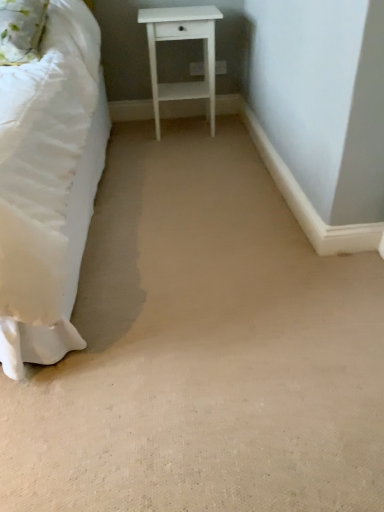
Describe the element at coordinates (21, 30) in the screenshot. I see `fluffy white pillow at upper left` at that location.

In order to click on fluffy white pillow at upper left in this screenshot , I will do `click(21, 30)`.

You are a GUI agent. You are given a task and a screenshot of the screen. Output one action in this format:
    pyautogui.click(x=<x>, y=<y>)
    Task: Click on the white matte nightstand at center
    The width and height of the screenshot is (384, 512).
    Given the screenshot: What is the action you would take?
    pyautogui.click(x=179, y=40)

The width and height of the screenshot is (384, 512). Describe the element at coordinates (179, 40) in the screenshot. I see `white matte nightstand at center` at that location.

Where is `fluffy white pillow at upper left`? The width and height of the screenshot is (384, 512). fluffy white pillow at upper left is located at coordinates (21, 30).

Between white matte nightstand at center and fluffy white pillow at upper left, which one appears on the left side from the viewer's perspective?

Positioned to the left is fluffy white pillow at upper left.

Which object is more forward, white matte nightstand at center or fluffy white pillow at upper left?

fluffy white pillow at upper left is closer to the camera.

Is point (213, 100) more distant than point (14, 2)?

Yes, point (213, 100) is behind point (14, 2).

From the image's perspective, would you say white matte nightstand at center is shown under fluffy white pillow at upper left?

No.

From the picture: From a real-world perspective, which is physically below, white matte nightstand at center or fluffy white pillow at upper left?

In real-world perspective, white matte nightstand at center is lower.

Can you confirm if white matte nightstand at center is wider than fluffy white pillow at upper left?

In fact, white matte nightstand at center might be narrower than fluffy white pillow at upper left.

Is white matte nightstand at center taller or shorter than fluffy white pillow at upper left?

Considering their sizes, white matte nightstand at center has more height than fluffy white pillow at upper left.

Considering the sizes of white matte nightstand at center and fluffy white pillow at upper left in the image, is white matte nightstand at center bigger or smaller than fluffy white pillow at upper left?

Considering their sizes, white matte nightstand at center takes up more space than fluffy white pillow at upper left.

Does white matte nightstand at center contain fluffy white pillow at upper left?

No, fluffy white pillow at upper left is not surrounded by white matte nightstand at center.

Is white matte nightstand at center next to fluffy white pillow at upper left?

No, white matte nightstand at center is not making contact with fluffy white pillow at upper left.

Is fluffy white pillow at upper left at the back of white matte nightstand at center?

That's not correct — white matte nightstand at center is not looking away from fluffy white pillow at upper left.

Identify the location of nightstand that appears below the fluffy white pillow at upper left (from a real-world perspective). This screenshot has height=512, width=384. (179, 40).

Consider the image. Which object is positioned more to the left, fluffy white pillow at upper left or white matte nightstand at center?

From the viewer's perspective, fluffy white pillow at upper left appears more on the left side.

From the picture: Is fluffy white pillow at upper left in front of white matte nightstand at center?

Result: That is True.

Which is nearer, (14, 41) or (185, 23)?

The point (14, 41) is in front.

From the image's perspective, between fluffy white pillow at upper left and white matte nightstand at center, who is located below?

fluffy white pillow at upper left, from the image's perspective.

From the picture: From a real-world perspective, between fluffy white pillow at upper left and white matte nightstand at center, who is vertically higher?

fluffy white pillow at upper left is physically above.

Is fluffy white pillow at upper left thinner than white matte nightstand at center?

No, fluffy white pillow at upper left is not thinner than white matte nightstand at center.

Is fluffy white pillow at upper left shorter than white matte nightstand at center?

Yes, fluffy white pillow at upper left is shorter than white matte nightstand at center.

Considering the sizes of objects fluffy white pillow at upper left and white matte nightstand at center in the image provided, who is smaller, fluffy white pillow at upper left or white matte nightstand at center?

fluffy white pillow at upper left is smaller.

Is fluffy white pillow at upper left inside or outside of white matte nightstand at center?

fluffy white pillow at upper left cannot be found inside white matte nightstand at center.

Would you consider fluffy white pillow at upper left to be distant from white matte nightstand at center?

fluffy white pillow at upper left is actually quite close to white matte nightstand at center.

Could you tell me if fluffy white pillow at upper left is turned towards white matte nightstand at center?

No, fluffy white pillow at upper left is not aimed at white matte nightstand at center.

You are a GUI agent. You are given a task and a screenshot of the screen. Output one action in this format:
    pyautogui.click(x=<x>, y=<y>)
    Task: Click on the nightstand above the fluffy white pillow at upper left (from the image's perspective)
    The image size is (384, 512).
    Given the screenshot: What is the action you would take?
    pyautogui.click(x=179, y=40)

There is a white matte nightstand at center. Identify the location of pillow above it (from a real-world perspective). (21, 30).

In the image, there is a fluffy white pillow at upper left. Identify the location of nightstand above it (from the image's perspective). The height and width of the screenshot is (512, 384). (179, 40).